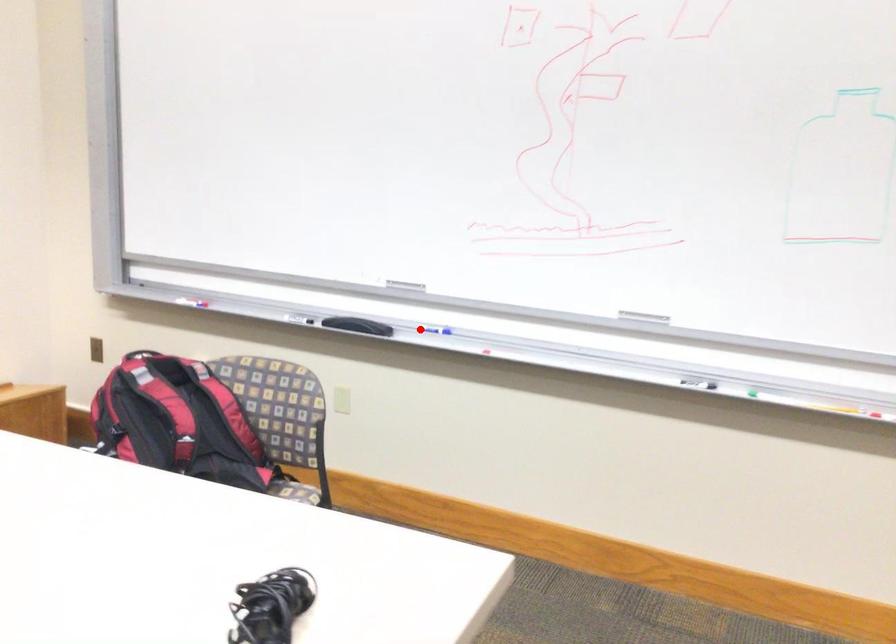
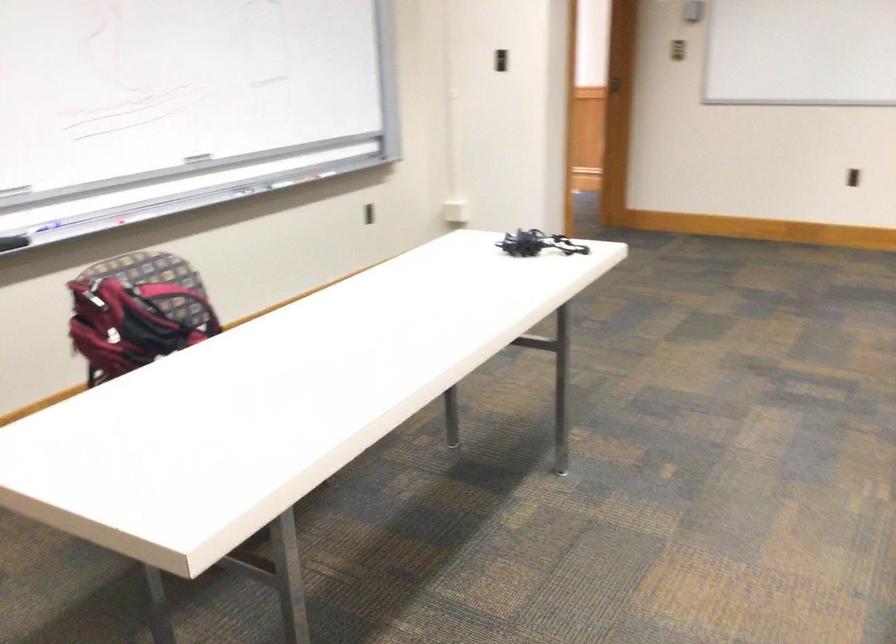
Locate, in the second image, the point that corresponds to the highlighted location in the first image.

(39, 229)